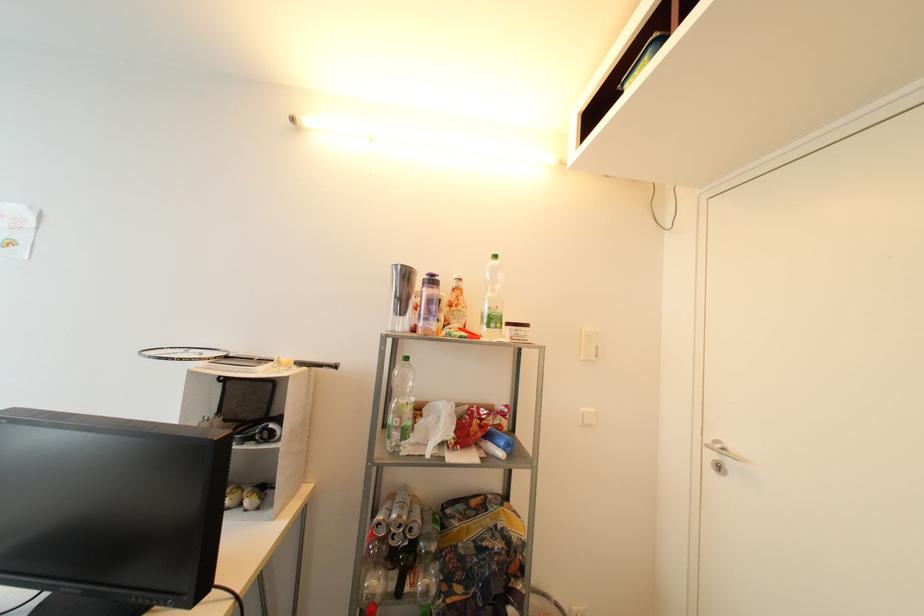
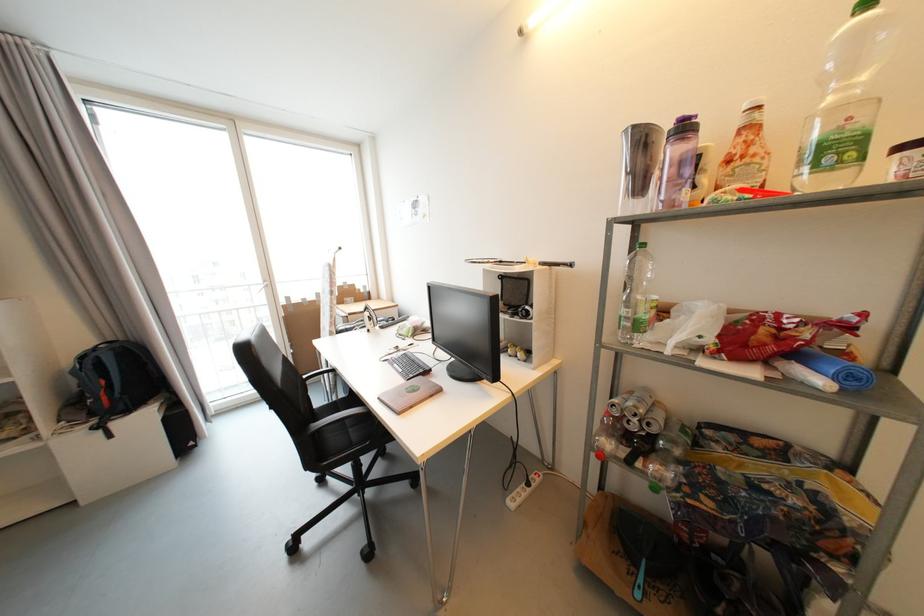
Locate, in the second image, the point that corresponds to (499,322) in the first image.

(842, 151)